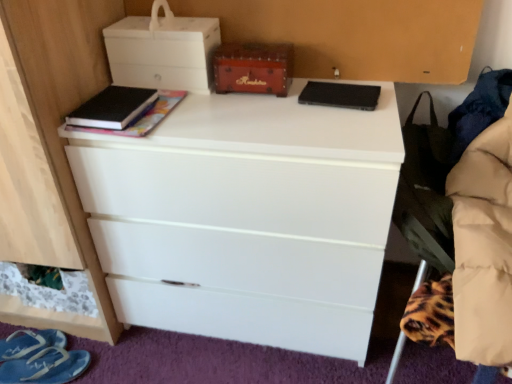
The image size is (512, 384). I want to click on vacant space to the left of black matte speaker at upper center, the second book viewed from the left, so click(x=280, y=106).